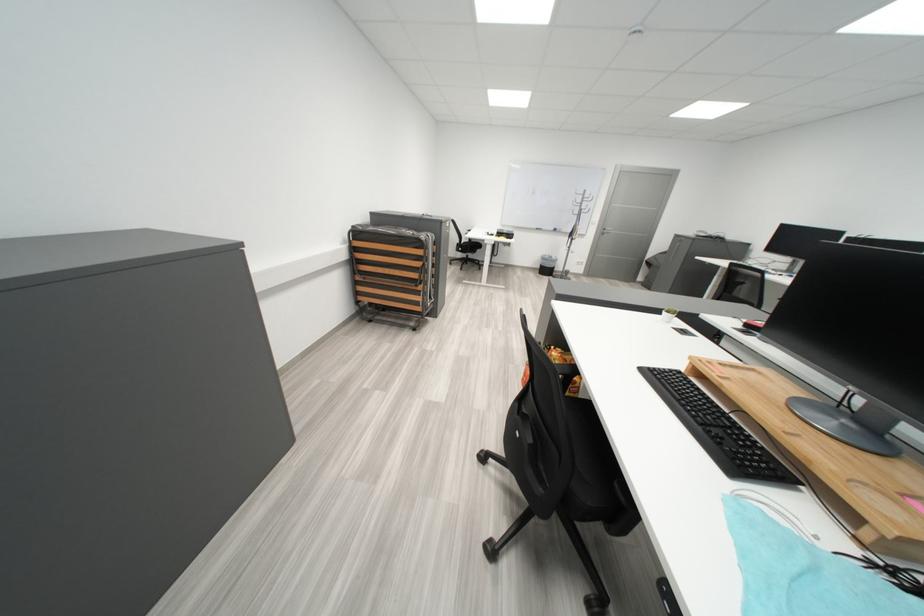
What do you see at coordinates (608, 230) in the screenshot? The width and height of the screenshot is (924, 616). I see `the grey door handle` at bounding box center [608, 230].